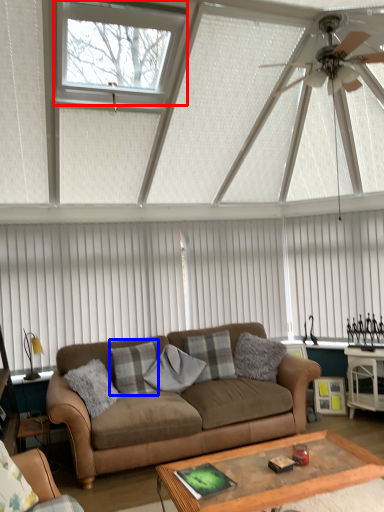
Question: Among these objects, which one is nearest to the camera, window (highlighted by a red box) or pillow (highlighted by a blue box)?

Choices:
 (A) window
 (B) pillow

Answer: (A)